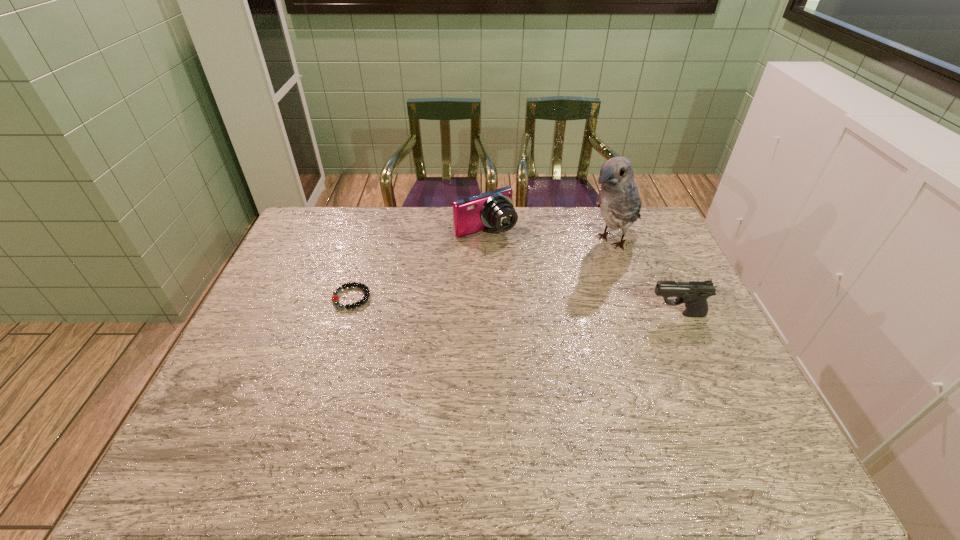
Identify the location of vacant region at the far edge. (379, 220).

In the image, there is a desktop. At what (x,y) coordinates should I click in order to perform the action: click on free space at the near edge. Please return your answer as a coordinate pair (x, y). This screenshot has height=540, width=960. Looking at the image, I should click on (399, 396).

This screenshot has height=540, width=960. I want to click on free point at the right edge, so click(x=721, y=393).

In the image, there is a desktop. Find the location of `blank space at the far right corner`. blank space at the far right corner is located at coordinates (651, 224).

Where is `free space between the parrot and the pistol`? free space between the parrot and the pistol is located at coordinates (644, 278).

The width and height of the screenshot is (960, 540). I want to click on vacant space in between the third object from right to left and the pistol, so click(581, 273).

What are the coordinates of `vacant area between the bracelet and the camera` in the screenshot? It's located at (419, 264).

What are the coordinates of `blank region between the tallest object and the camera` in the screenshot? It's located at (548, 236).

Where is `vacant point located between the tallest object and the bracelet`? The image size is (960, 540). vacant point located between the tallest object and the bracelet is located at coordinates (481, 269).

Locate an element on the screen. This screenshot has width=960, height=540. free spot between the parrot and the leftmost object is located at coordinates tap(481, 269).